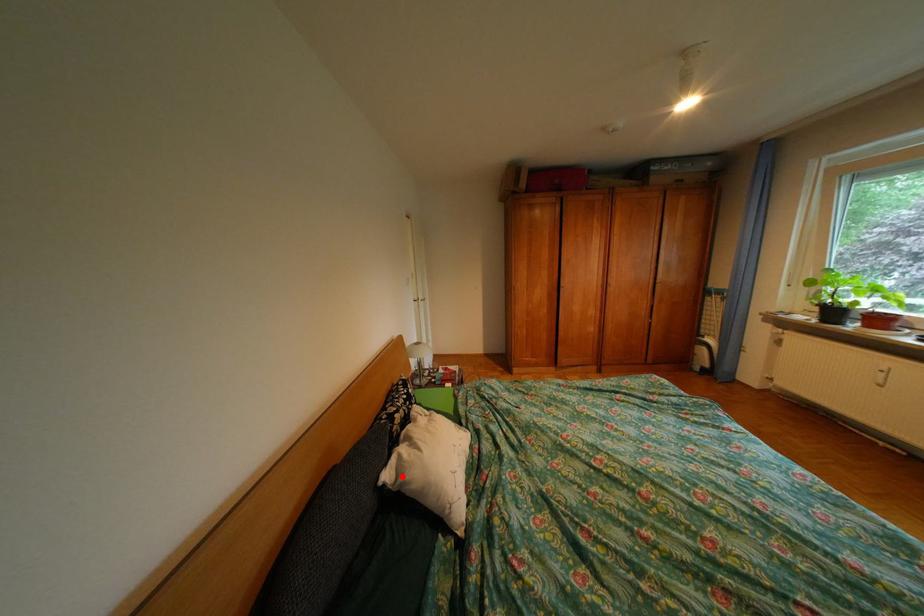
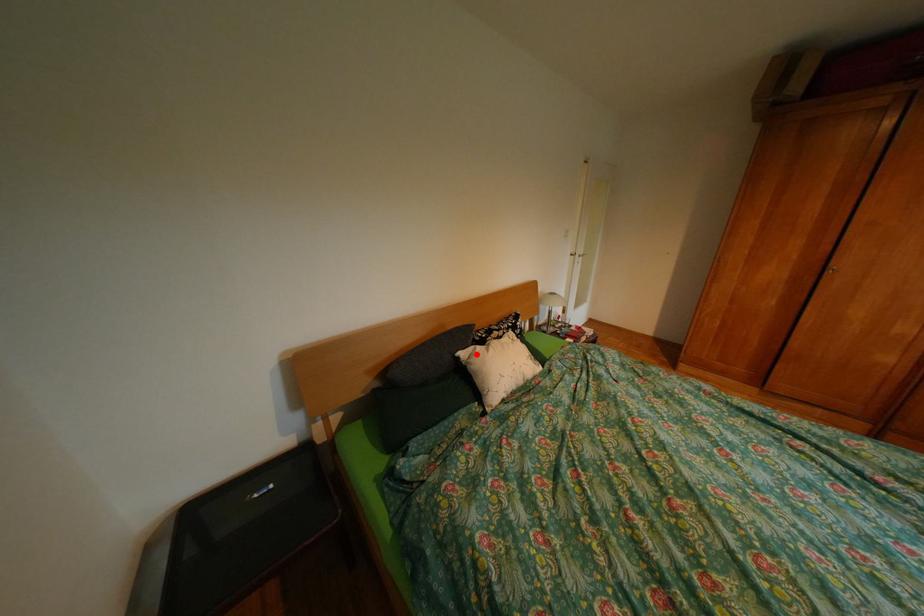
I am providing you with two images of the same scene from different viewpoints. A red point is marked on the first image and another point is marked on the second image. Are the points marked in image1 and image2 representing the same 3D position?

Yes